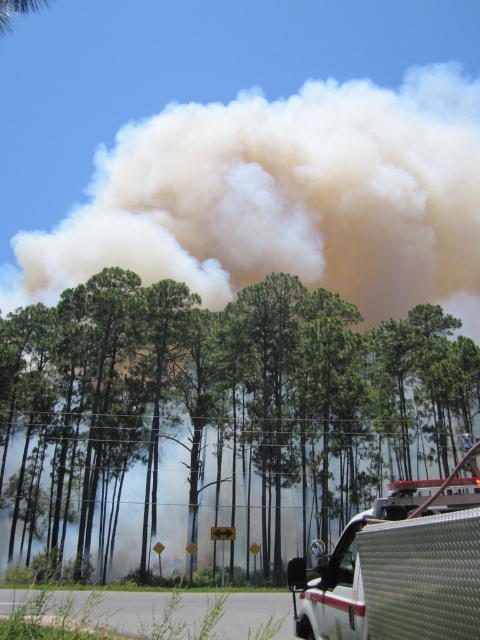
You are a firefighter assessing the situation from a safe distance. You notice the green leafy tree at center in the scene. Based on the distance provided, can you estimate whether the tree is within the immediate danger zone of the fire? Assume the danger zone extends up to 100 feet from the fire source.

The green leafy tree at center is 92.48 feet away from the viewer. Since the danger zone extends up to 100 feet from the fire source, the tree is within the immediate danger zone as it is less than 100 feet away.

Looking at this image, you are a firefighter assessing the scene. You need to position an emergency vehicle between the green leafy tree at center and the white textured truck at lower right. Is there enough space for a vehicle that is 12 meters long?

The distance between the green leafy tree at center and the white textured truck at lower right is 15.33 meters. Since the vehicle is 12 meters long, there is sufficient space to position it between them.

You are a firefighter assessing the scene. You notice two points of interest marked as point 1 at coordinates point (170, 321) and point 2 at coordinates point (392, 506). Which point is closer to your current position?

Point 1 at coordinates point (170, 321) is closer to your current position because it is further to the camera than point 2 at coordinates point (392, 506).